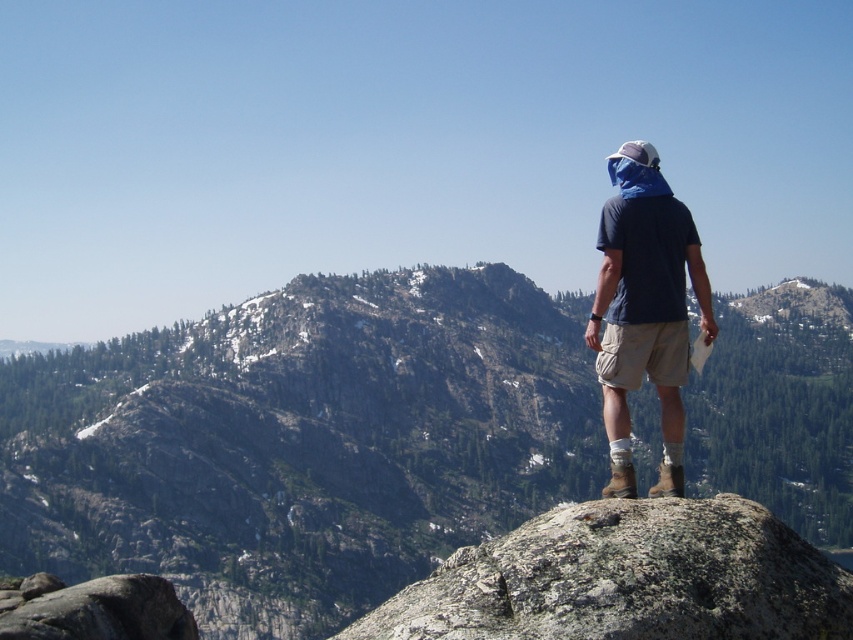
Looking at this image, you are a hiker who has just arrived at the mountain trailhead. You see two gray rocks in the distance. The first is the gray rough rock at center, and the second is the gray rock at lower left. Which gray rock is positioned more to the right side of your view?

The gray rough rock at center is positioned more to the right side of your view compared to the gray rock at lower left.

You are a hiker trying to navigate through the mountain path. You see the green textured rock at center and the gray rock at lower left. Which rock would you choose to step on if you want to avoid stepping on the smaller one?

The green textured rock at center has a larger size compared to gray rock at lower left, so you should step on the green textured rock at center to avoid the smaller one.